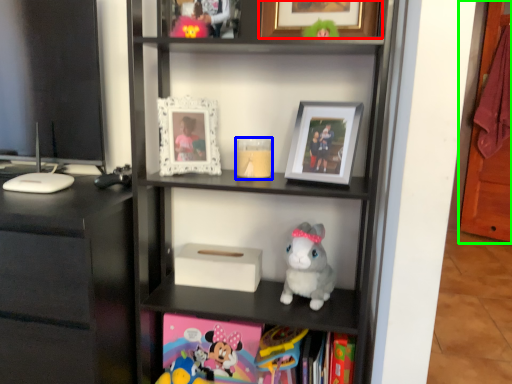
Question: Considering the real-world distances, which object is closest to picture frame (highlighted by a red box)? candle holder (highlighted by a blue box) or glass door (highlighted by a green box).

Choices:
 (A) candle holder
 (B) glass door

Answer: (A)